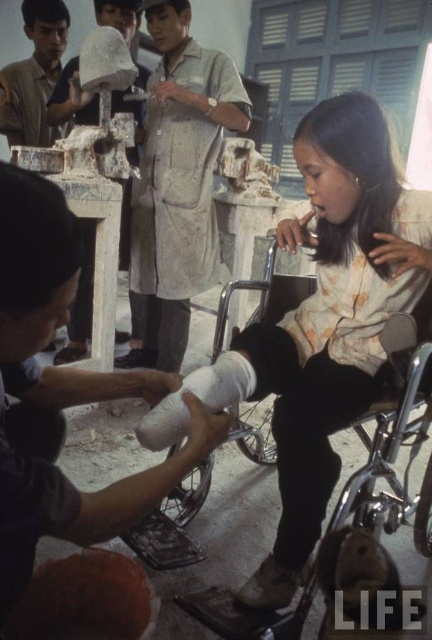
Is the position of silver metallic wheelchair at lower center more distant than that of white matte plaster bandage at lower center?

That is True.

In the scene shown: Who is shorter, silver metallic wheelchair at lower center or white matte plaster bandage at lower center?

white matte plaster bandage at lower center

In the scene shown: Who is more distant from viewer, (273, 298) or (205, 388)?

Point (273, 298)

The image size is (432, 640). Find the location of `silver metallic wheelchair at lower center`. silver metallic wheelchair at lower center is located at coordinates (388, 435).